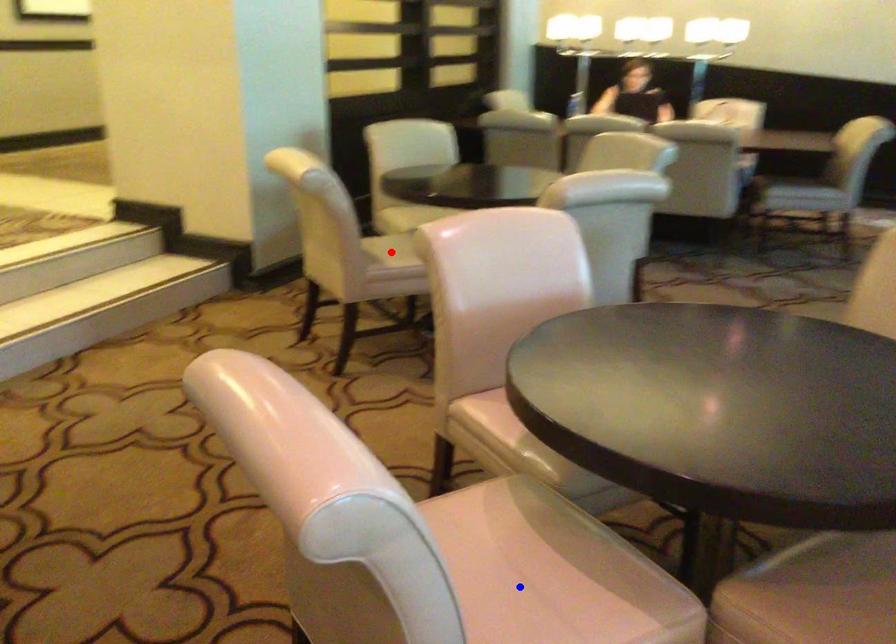
Question: Which of the two points in the image is closer to the camera?

Choices:
 (A) Blue point is closer.
 (B) Red point is closer.

Answer: (A)